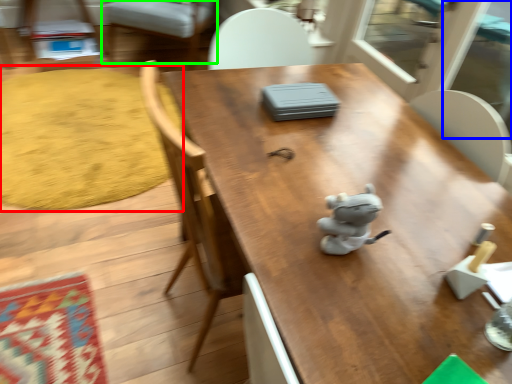
Question: Which object is positioned farthest from mat (highlighted by a red box)? Select from screen door (highlighted by a blue box) and chair (highlighted by a green box).

Choices:
 (A) screen door
 (B) chair

Answer: (A)